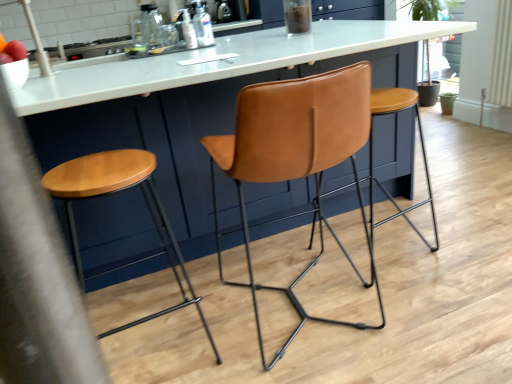
Locate an element on the screen. vacant area that is in front of leather stool at center, acting as the second stool starting from the left is located at coordinates (436, 297).